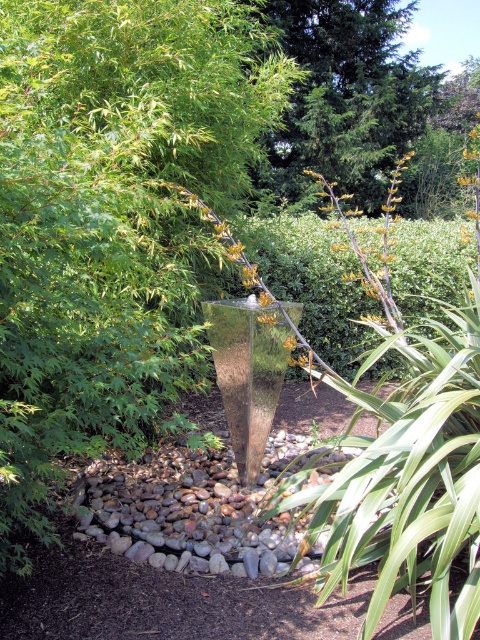
Question: Does green textured tree at upper center lie in front of yellow-green textured flower at center?

Choices:
 (A) no
 (B) yes

Answer: (A)

Question: Which object is the closest to the green leafy tree at center?

Choices:
 (A) green textured tree at upper center
 (B) yellow-green textured flower at center

Answer: (B)

Question: Is green leafy tree at center above yellow-green textured flower at center?

Choices:
 (A) yes
 (B) no

Answer: (A)

Question: Is green leafy tree at center above yellow-green textured flower at center?

Choices:
 (A) no
 (B) yes

Answer: (B)

Question: Which point is closer to the camera?

Choices:
 (A) (62, 257)
 (B) (304, 140)
 (C) (289, 346)

Answer: (A)

Question: Which of the following is the closest to the observer?

Choices:
 (A) green leafy tree at center
 (B) yellow-green textured flower at center

Answer: (A)